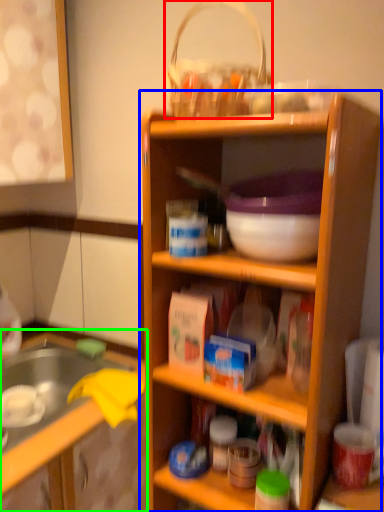
Question: Which object is the farthest from basket (highlighted by a red box)? Choose among these: shelf (highlighted by a blue box) or cabinetry (highlighted by a green box).

Choices:
 (A) shelf
 (B) cabinetry

Answer: (B)